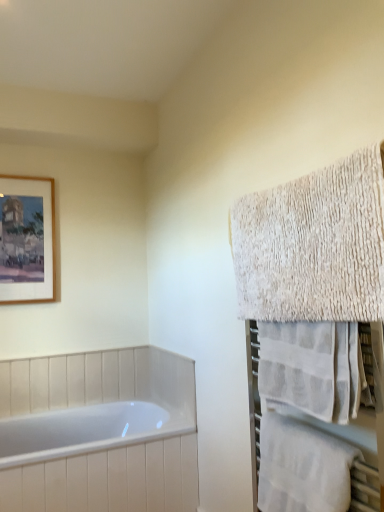
Question: From their relative heights in the image, would you say wooden-framed painting at upper left is taller or shorter than white textured towel at right, which is the 2th towel in top-to-bottom order?

Choices:
 (A) short
 (B) tall

Answer: (B)

Question: From a real-world perspective, is wooden-framed painting at upper left positioned above or below white textured towel at right, which is counted as the 2th towel, starting from the bottom?

Choices:
 (A) below
 (B) above

Answer: (B)

Question: Estimate the real-world distances between objects in this image. Which object is farther from the wooden-framed painting at upper left?

Choices:
 (A) white glossy bathtub at lower left
 (B) white textured towel at right, which is the 3th towel from top to bottom
 (C) white textured towel at right, positioned as the first towel in top-to-bottom order
 (D) white textured towel at right, which is counted as the 2th towel, starting from the bottom

Answer: (B)

Question: Which object is the farthest from the white textured towel at right, which is counted as the 2th towel, starting from the bottom?

Choices:
 (A) white textured towel at right, the third towel when ordered from bottom to top
 (B) white textured towel at right, the 1th towel positioned from the bottom
 (C) wooden-framed painting at upper left
 (D) white glossy bathtub at lower left

Answer: (C)